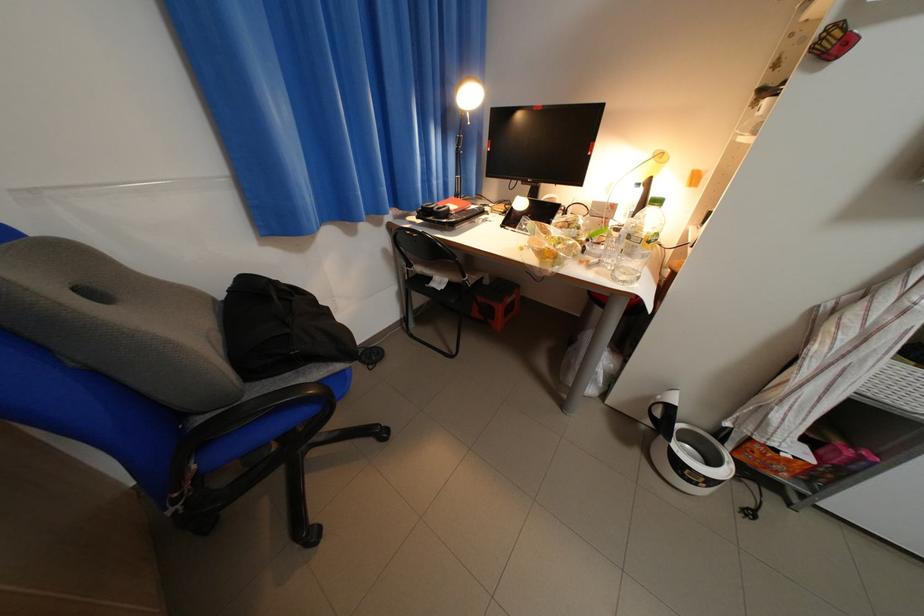
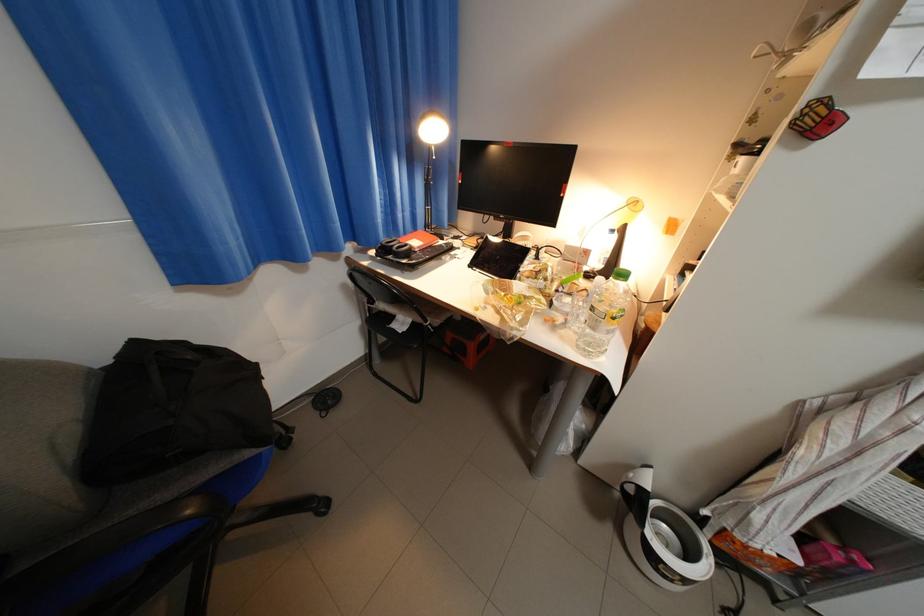
Question: How did the camera likely rotate?

Choices:
 (A) Left
 (B) Right
 (C) Up
 (D) Down

Answer: (C)